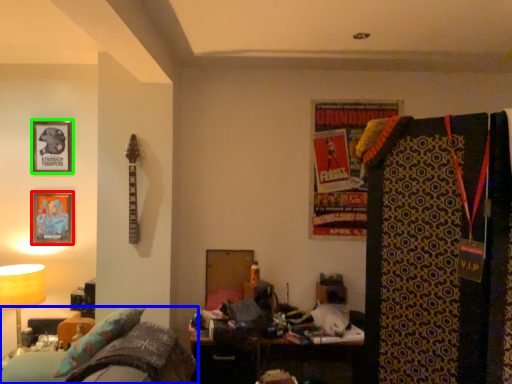
Question: Considering the real-world distances, which object is closest to picture frame (highlighted by a red box)? furniture (highlighted by a blue box) or picture frame (highlighted by a green box).

Choices:
 (A) furniture
 (B) picture frame

Answer: (B)